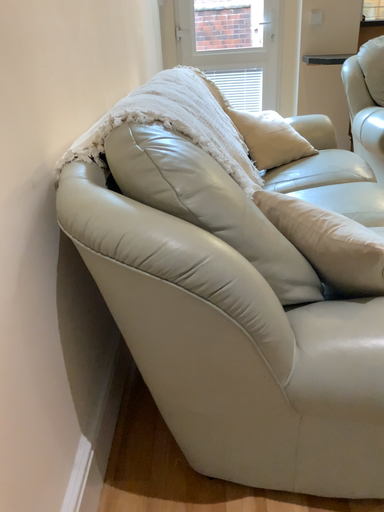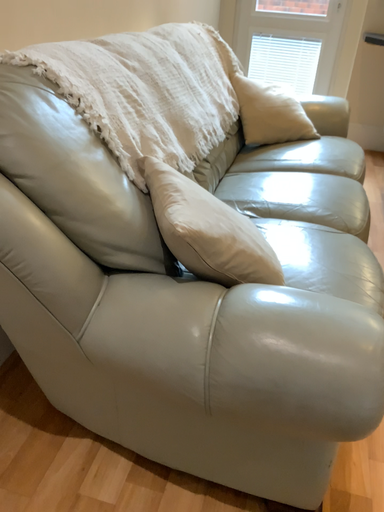
Question: Which way did the camera rotate in the video?

Choices:
 (A) rotated right
 (B) rotated left

Answer: (B)